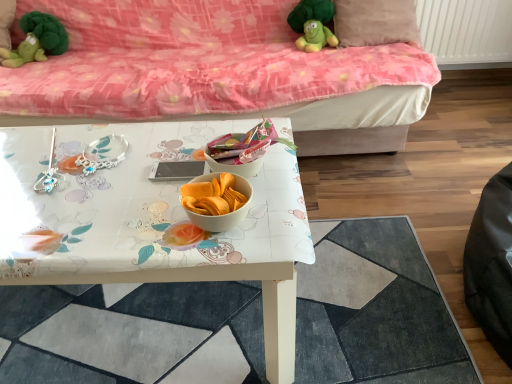
Question: From the image's perspective, relative to green plush toy at upper left, which is the first toy in left-to-right order, is velvet pink couch at upper center above or below?

Choices:
 (A) below
 (B) above

Answer: (A)

Question: Considering the positions of velvet pink couch at upper center and green plush toy at upper left, which is the first toy in left-to-right order, in the image, is velvet pink couch at upper center bigger or smaller than green plush toy at upper left, which is the first toy in left-to-right order,?

Choices:
 (A) small
 (B) big

Answer: (B)

Question: Estimate the real-world distances between objects in this image. Which object is closer to the velvet pink couch at upper center?

Choices:
 (A) green plush toy at upper center, the first toy in the right-to-left sequence
 (B) green plush toy at upper left, which is the first toy in left-to-right order
 (C) peachy soft pillow at upper right
 (D) white glossy table at center
 (E) white glossy table at center

Answer: (C)

Question: Based on their relative distances, which object is nearer to the white glossy table at center?

Choices:
 (A) white glossy table at center
 (B) green plush toy at upper center, the first toy in the right-to-left sequence
 (C) peachy soft pillow at upper right
 (D) green plush toy at upper left, the 2th toy when ordered from right to left
 (E) velvet pink couch at upper center

Answer: (A)